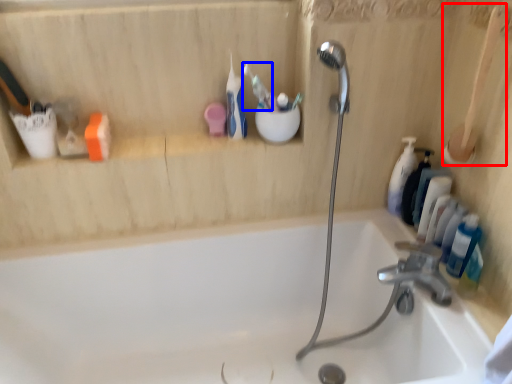
Question: Among these objects, which one is nearest to the camera, brush (highlighted by a red box) or toothbrush (highlighted by a blue box)?

Choices:
 (A) brush
 (B) toothbrush

Answer: (A)